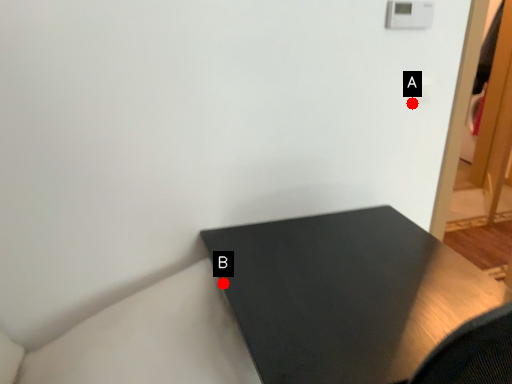
Question: Two points are circled on the image, labeled by A and B beside each circle. Which point is closer to the camera taking this photo?

Choices:
 (A) A is closer
 (B) B is closer

Answer: (B)